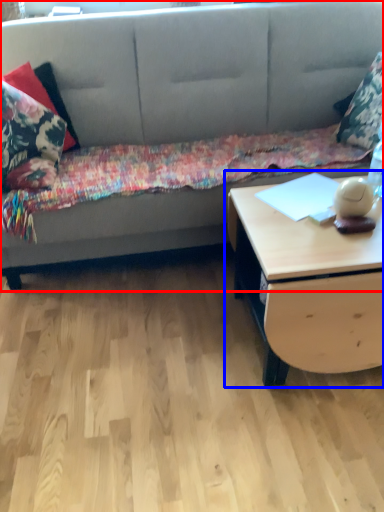
Question: Which object appears closest to the camera in this image, studio couch (highlighted by a red box) or table (highlighted by a blue box)?

Choices:
 (A) studio couch
 (B) table

Answer: (B)